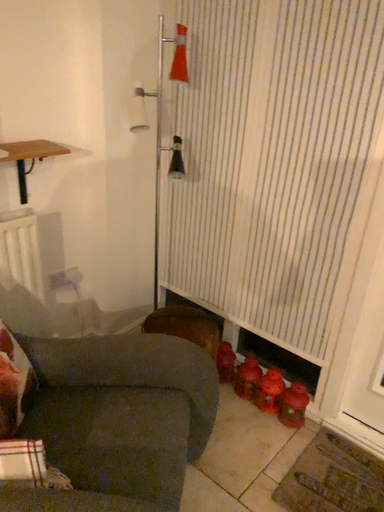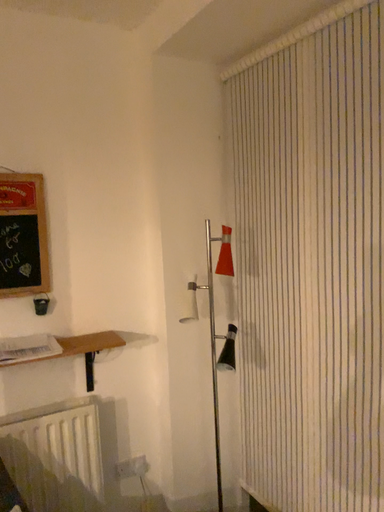
Question: Which way did the camera rotate in the video?

Choices:
 (A) rotated downward
 (B) rotated upward

Answer: (B)